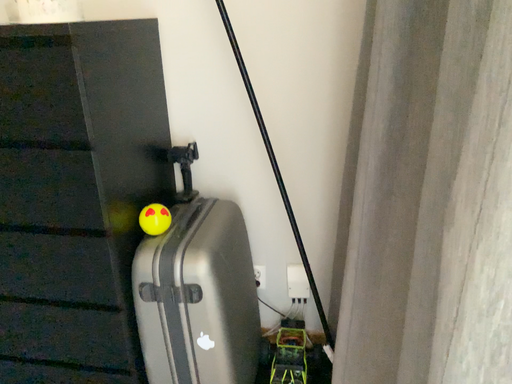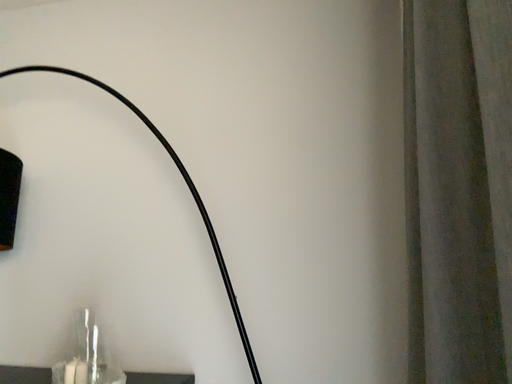
Question: Which way did the camera rotate in the video?

Choices:
 (A) rotated upward
 (B) rotated downward

Answer: (A)